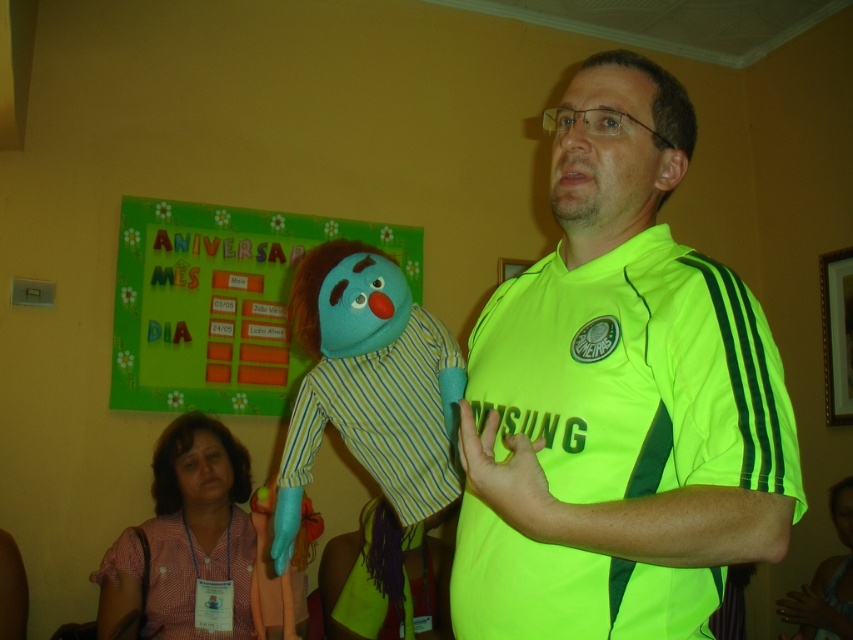
Question: Is blue fabric puppet at center positioned behind pink cotton shirt at lower left?

Choices:
 (A) yes
 (B) no

Answer: (B)

Question: Is green paperboard at upper center wider than blue fabric puppet at center?

Choices:
 (A) yes
 (B) no

Answer: (A)

Question: Among these points, which one is farthest from the camera?

Choices:
 (A) (251, 552)
 (B) (531, 586)
 (C) (374, 349)
 (D) (141, 397)

Answer: (D)

Question: Which point is closer to the camera?

Choices:
 (A) green paperboard at upper center
 (B) blue fabric puppet at center

Answer: (B)

Question: Which of these objects is positioned closest to the green paperboard at upper center?

Choices:
 (A) blue fabric puppet at center
 (B) pink cotton shirt at lower left

Answer: (B)

Question: Is neon green jersey at center further to camera compared to blue fabric puppet at center?

Choices:
 (A) no
 (B) yes

Answer: (A)